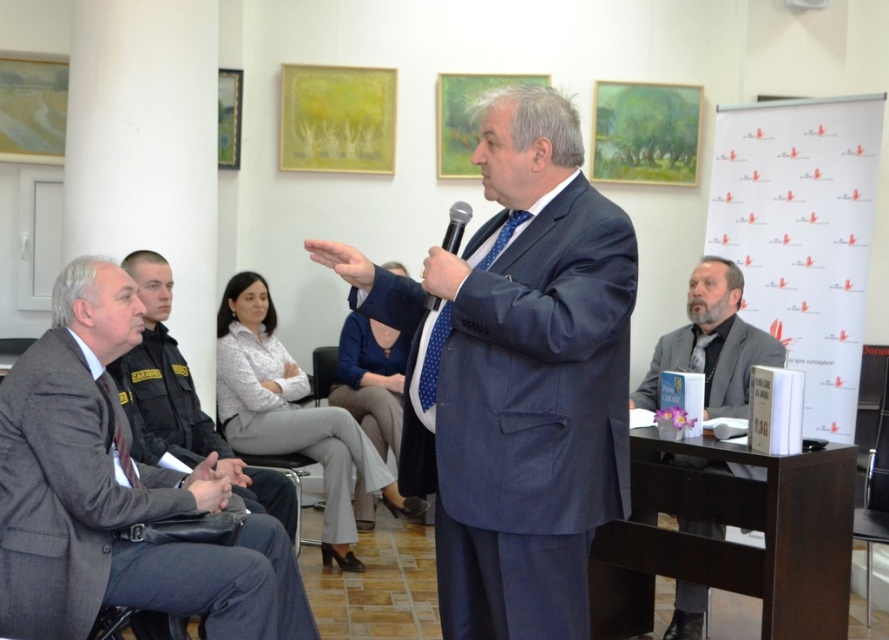
Question: Which is nearer to the black plastic microphone at center?

Choices:
 (A) blue textured suit at center
 (B) gray wool suit at left
 (C) gray woolen jacket at lower right
 (D) dark gray suit at left

Answer: (A)

Question: Which point is farther to the camera?

Choices:
 (A) (497, 388)
 (B) (707, 346)
 (C) (98, 488)
 (D) (247, 497)

Answer: (B)

Question: Does gray woolen jacket at lower right lie in front of black plastic microphone at center?

Choices:
 (A) no
 (B) yes

Answer: (A)

Question: Which object is farther from the camera taking this photo?

Choices:
 (A) black plastic microphone at center
 (B) blue textured suit at center
 (C) gray woolen jacket at lower right

Answer: (C)

Question: Considering the relative positions of gray wool suit at left and dark gray suit at left in the image provided, where is gray wool suit at left located with respect to dark gray suit at left?

Choices:
 (A) left
 (B) right

Answer: (B)

Question: Observing the image, what is the correct spatial positioning of gray wool suit at left in reference to dark gray suit at left?

Choices:
 (A) left
 (B) right

Answer: (B)